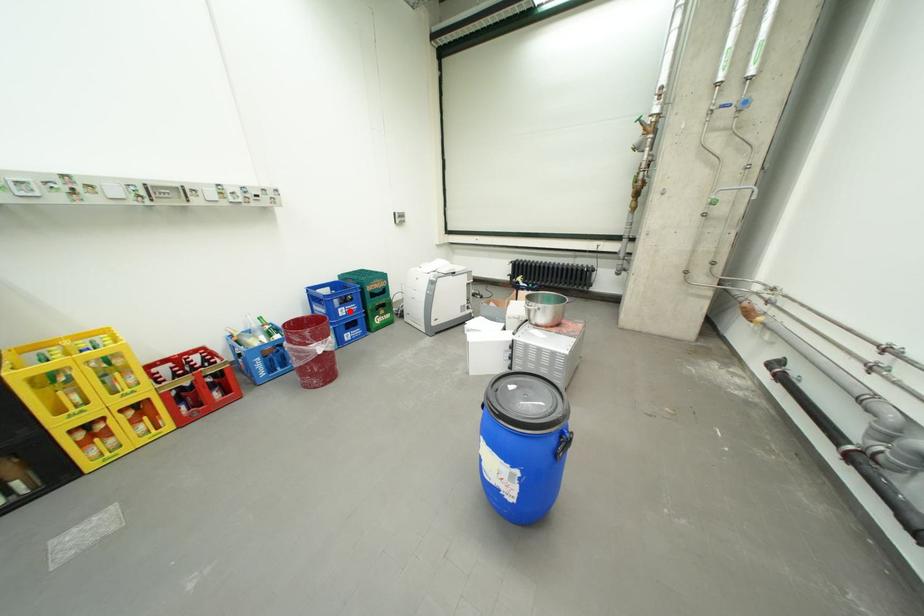
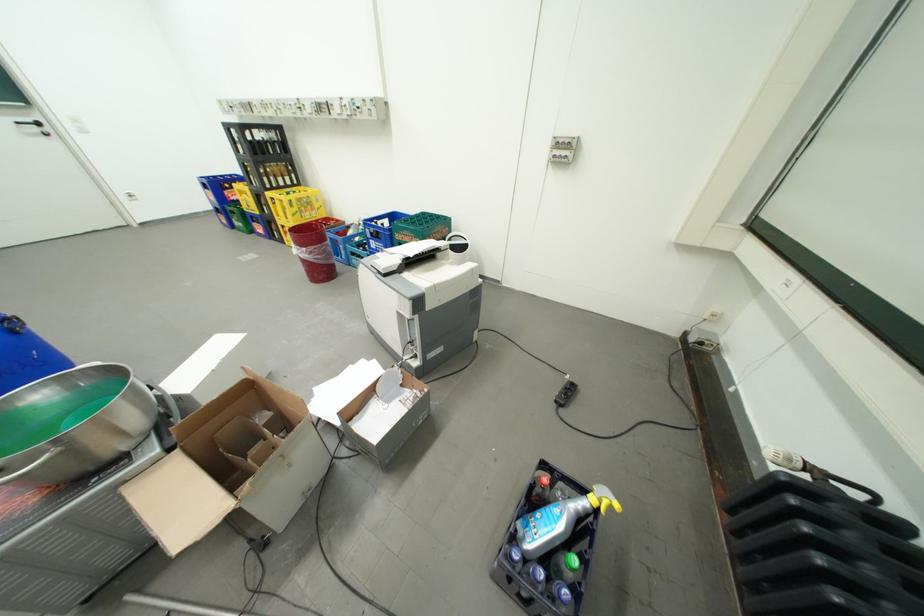
Question: I am providing you with two images of the same scene from different viewpoints. Image1 has a red point marked. In image2, the corresponding 3D location appears at what relative position? Reply with the corresponding letter.

Choices:
 (A) Closer
 (B) Farther

Answer: (B)